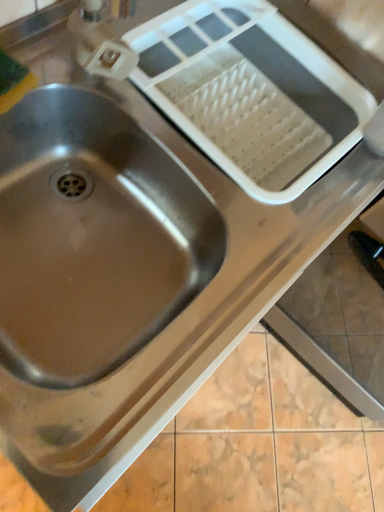
Describe the element at coordinates (250, 93) in the screenshot. The width and height of the screenshot is (384, 512). I see `white plastic dish rack at upper right` at that location.

At what (x,y) coordinates should I click in order to perform the action: click on white plastic dish rack at upper right. Please return your answer as a coordinate pair (x, y). Looking at the image, I should click on (250, 93).

The width and height of the screenshot is (384, 512). I want to click on white plastic dish rack at upper right, so click(250, 93).